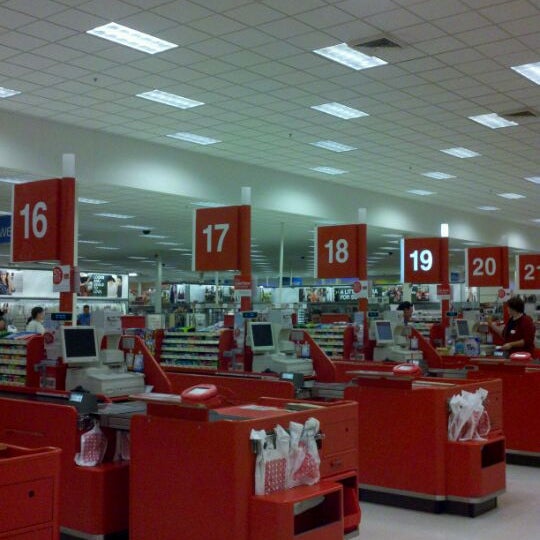
Locate an element on the screen. shelves is located at coordinates (191, 347).